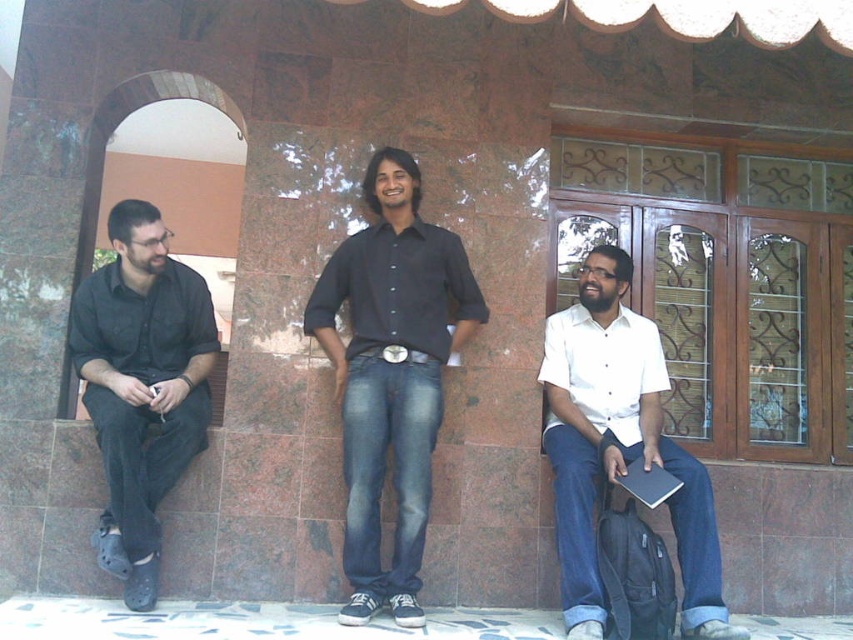
You are a photographer trying to capture a group photo of the white matte shirt at center and the black matte shirt at left. Since you want to ensure both are fully visible in the frame, which person should you position closer to the camera to avoid being cut off?

The white matte shirt at center should be positioned closer to the camera because it might be wider than the black matte shirt at left, ensuring both fit within the frame.

You are standing at the point marked as point (341,346) and want to walk to the building entrance. The building entrance is 4.32 meters away from you. Is the building entrance located to your left or right side?

The building entrance is located to your right side because the distance between you and the building entrance is 4.32 meters, but the exact direction isn

You are a delivery person who needs to place a small package between the black denim jeans at center and the black matte shirt at left. The package is 80 centimeters long. Is there enough space between them to place the package?

The distance between the black denim jeans at center and the black matte shirt at left is 75.85 centimeters. Since the package is 80 centimeters long, it is longer than the available space. Therefore, the package cannot be placed between them.